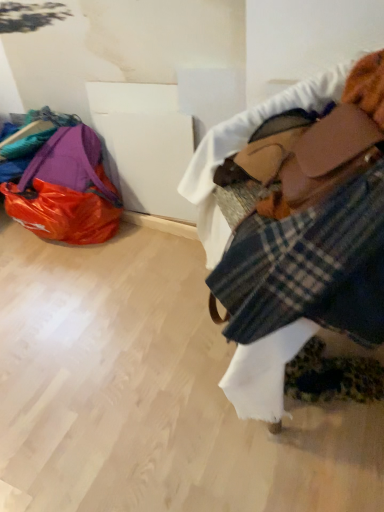
Question: Does plaid fabric at upper right contain plaid fabric at right?

Choices:
 (A) yes
 (B) no

Answer: (A)

Question: Does plaid fabric at upper right lie in front of plaid fabric at right?

Choices:
 (A) no
 (B) yes

Answer: (B)

Question: Is plaid fabric at upper right facing away from plaid fabric at right?

Choices:
 (A) yes
 (B) no

Answer: (A)

Question: Considering the relative sizes of plaid fabric at upper right and plaid fabric at right in the image provided, is plaid fabric at upper right taller than plaid fabric at right?

Choices:
 (A) no
 (B) yes

Answer: (B)

Question: Is plaid fabric at upper right wider than plaid fabric at right?

Choices:
 (A) no
 (B) yes

Answer: (B)

Question: Is plaid fabric at upper right taller or shorter than matte purple bag at left?

Choices:
 (A) tall
 (B) short

Answer: (A)

Question: Is plaid fabric at upper right situated inside matte purple bag at left or outside?

Choices:
 (A) inside
 (B) outside

Answer: (B)

Question: Considering the positions of plaid fabric at upper right and matte purple bag at left in the image, is plaid fabric at upper right wider or thinner than matte purple bag at left?

Choices:
 (A) wide
 (B) thin

Answer: (A)

Question: Considering the positions of point (223, 151) and point (36, 224), is point (223, 151) closer or farther from the camera than point (36, 224)?

Choices:
 (A) farther
 (B) closer

Answer: (B)

Question: In terms of height, does matte purple bag at left look taller or shorter compared to plaid fabric at right?

Choices:
 (A) tall
 (B) short

Answer: (B)

Question: Is matte purple bag at left inside or outside of plaid fabric at right?

Choices:
 (A) inside
 (B) outside

Answer: (B)

Question: From a real-world perspective, is matte purple bag at left positioned above or below plaid fabric at right?

Choices:
 (A) below
 (B) above

Answer: (A)

Question: Is matte purple bag at left to the left or to the right of plaid fabric at right in the image?

Choices:
 (A) right
 (B) left

Answer: (B)

Question: Considering the positions of matte purple bag at left and plaid fabric at upper right in the image, is matte purple bag at left taller or shorter than plaid fabric at upper right?

Choices:
 (A) short
 (B) tall

Answer: (A)

Question: Considering the positions of matte purple bag at left and plaid fabric at upper right in the image, is matte purple bag at left wider or thinner than plaid fabric at upper right?

Choices:
 (A) wide
 (B) thin

Answer: (B)